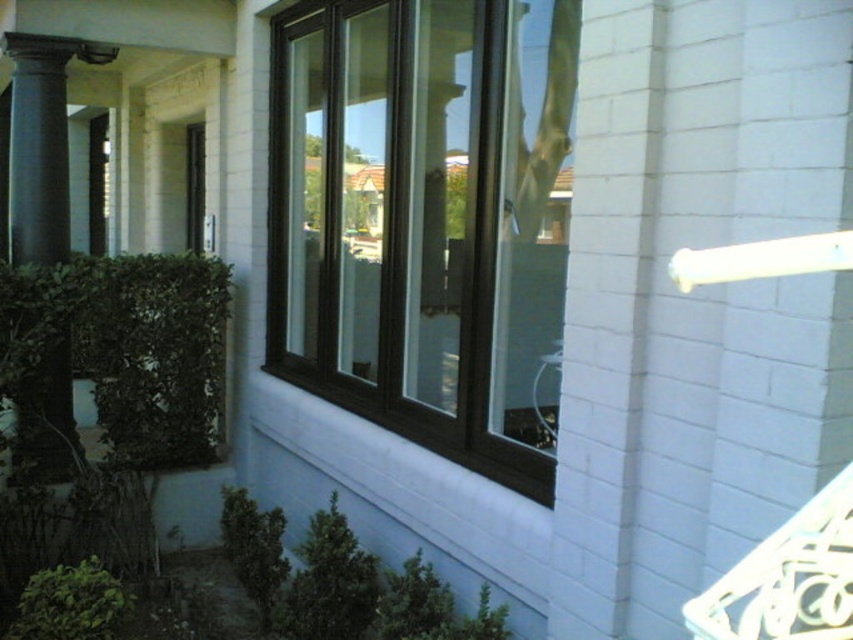
Question: Can you confirm if brown wood window at center is wider than dark gray stone column at left?

Choices:
 (A) yes
 (B) no

Answer: (A)

Question: Is brown wood window at center above dark gray stone column at left?

Choices:
 (A) no
 (B) yes

Answer: (A)

Question: Among these points, which one is nearest to the camera?

Choices:
 (A) (351, 284)
 (B) (62, 243)

Answer: (A)

Question: Can you confirm if brown wood window at center is thinner than dark gray stone column at left?

Choices:
 (A) no
 (B) yes

Answer: (A)

Question: Which point is closer to the camera?

Choices:
 (A) (468, 317)
 (B) (41, 36)

Answer: (A)

Question: Which of the following is the farthest from the observer?

Choices:
 (A) brown wood window at center
 (B) dark gray stone column at left

Answer: (B)